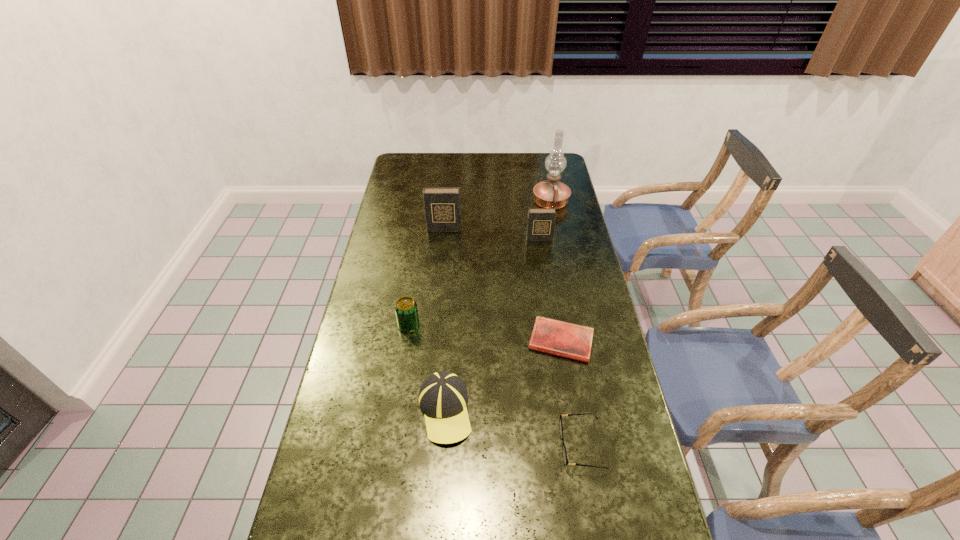
What are the coordinates of `unoccupied position between the green beer can and the fifth tallest object` in the screenshot? It's located at (427, 368).

The height and width of the screenshot is (540, 960). Identify the location of vacant space in between the red diary and the second shortest object. (571, 393).

What are the coordinates of `empty space that is in between the second shortest object and the third shortest object` in the screenshot? It's located at (514, 428).

Find the location of a particular element. This screenshot has width=960, height=540. vacant point located between the beer can and the tallest diary is located at coordinates (426, 277).

Identify the location of free space between the smaller dark diary and the left dark diary. (492, 234).

Where is `empty location between the black baseball cap and the nearer dark diary`? This screenshot has width=960, height=540. empty location between the black baseball cap and the nearer dark diary is located at coordinates (492, 325).

Where is `vacant space that is in between the sixth tallest object and the third shortest object`? The width and height of the screenshot is (960, 540). vacant space that is in between the sixth tallest object and the third shortest object is located at coordinates [514, 428].

You are a GUI agent. You are given a task and a screenshot of the screen. Output one action in this format:
    pyautogui.click(x=<x>, y=<y>)
    Task: Click on the object that stands as the sixth closest to the third farthest object
    
    Given the screenshot: What is the action you would take?
    pyautogui.click(x=564, y=453)

Select which object appears as the fifth closest to the tallest object. Please provide its 2D coordinates. Your answer should be formatted as a tuple, i.e. [(x, y)], where the tuple contains the x and y coordinates of a point satisfying the conditions above.

[(443, 397)]

At what (x,y) coordinates should I click in order to perform the action: click on diary that is the second closest to the fourth shortest object. Please return your answer as a coordinate pair (x, y). Looking at the image, I should click on (442, 205).